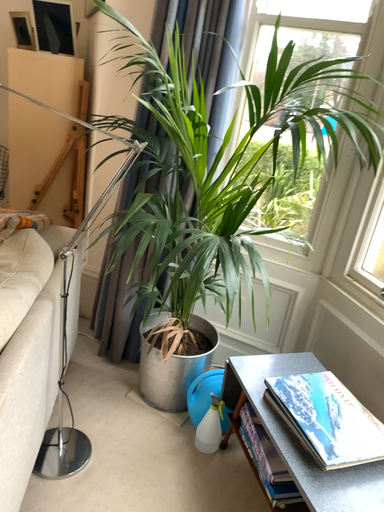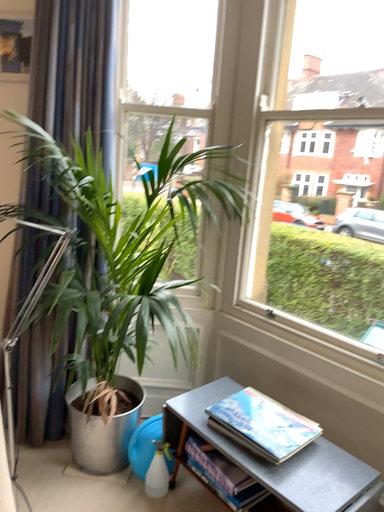
Question: How did the camera likely rotate when shooting the video?

Choices:
 (A) rotated left
 (B) rotated right

Answer: (B)